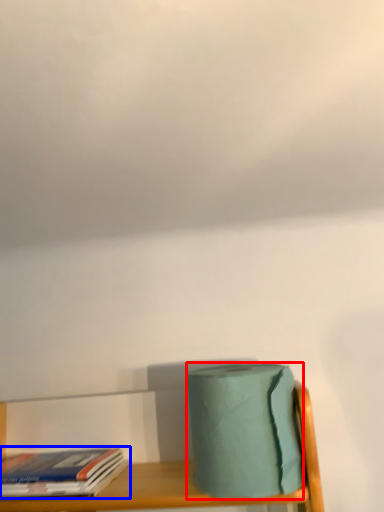
Question: Among these objects, which one is farthest to the camera, toilet paper (highlighted by a red box) or book (highlighted by a blue box)?

Choices:
 (A) toilet paper
 (B) book

Answer: (B)